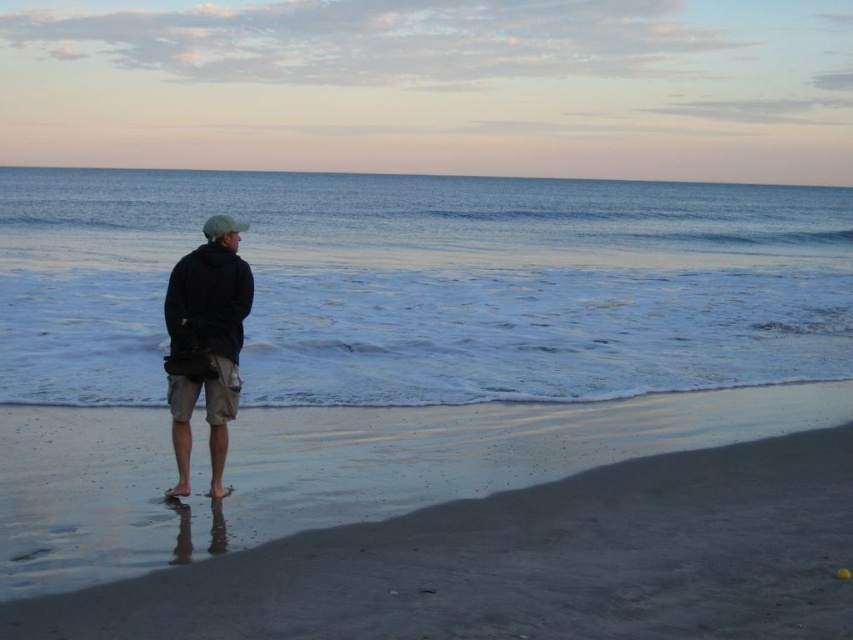
You are standing on the beach and want to take a photo of the blue smooth water at center. Where should you position yourself to capture the water in the center of your camera frame?

To capture the blue smooth water at center in the center of your camera frame, position yourself directly facing the point where the water meets the shore at coordinates approximately 0.447 on the horizontal axis and 0.502 on the vertical axis, as indicated by the description.